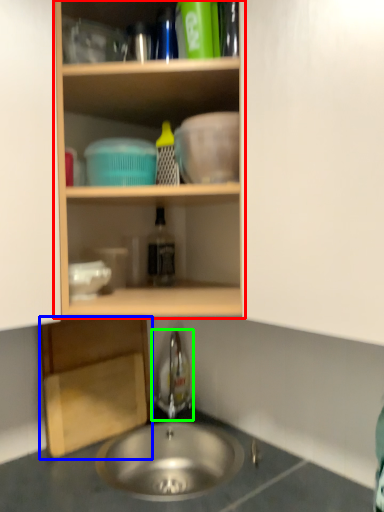
Question: Considering the real-world distances, which object is closest to shelf (highlighted by a red box)? cabinetry (highlighted by a blue box) or faucet (highlighted by a green box).

Choices:
 (A) cabinetry
 (B) faucet

Answer: (A)